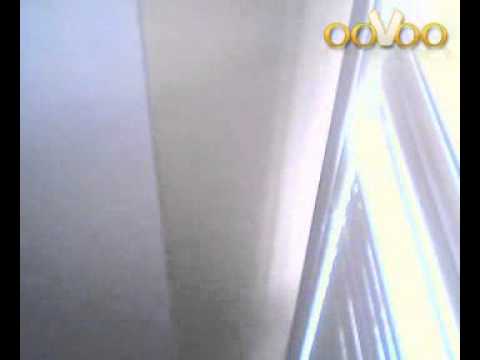
The width and height of the screenshot is (480, 360). I want to click on ceiling, so click(x=202, y=146).